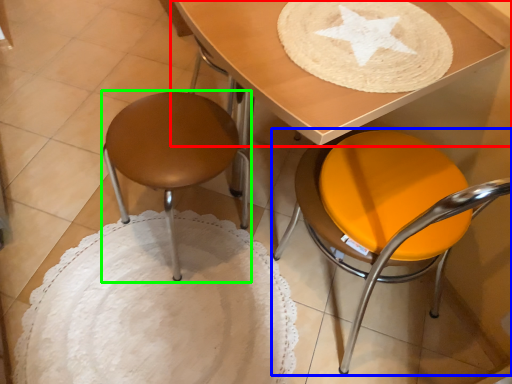
Question: Based on their relative distances, which object is farther from table (highlighted by a red box)? Choose from chair (highlighted by a blue box) and stool (highlighted by a green box).

Choices:
 (A) chair
 (B) stool

Answer: (B)